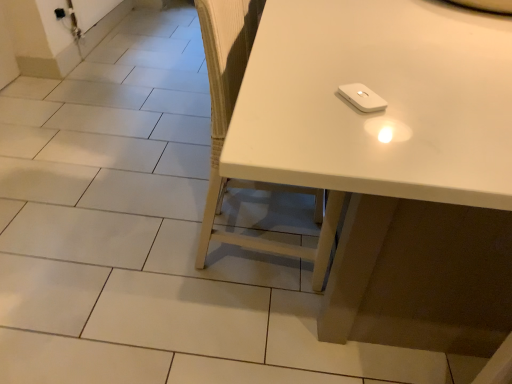
Question: Would you say white matte chair at center is inside or outside white matte wii controller at upper center?

Choices:
 (A) outside
 (B) inside

Answer: (A)

Question: From the image's perspective, is white matte chair at center above or below white matte wii controller at upper center?

Choices:
 (A) above
 (B) below

Answer: (B)

Question: Estimate the real-world distances between objects in this image. Which object is farther from the white matte wii controller at upper center?

Choices:
 (A) white matte chair at center
 (B) white glossy table at upper right

Answer: (A)

Question: Based on their relative distances, which object is nearer to the white glossy table at upper right?

Choices:
 (A) white matte chair at center
 (B) white matte wii controller at upper center

Answer: (B)